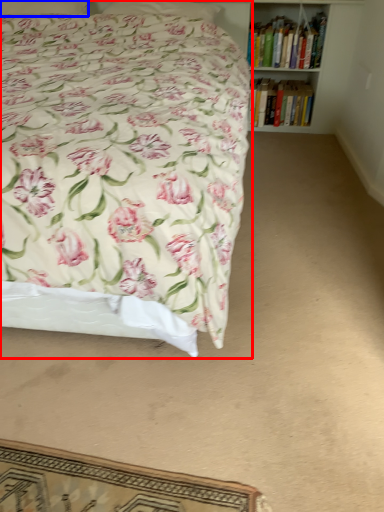
Question: Which of the following is the closest to the observer, bed (highlighted by a red box) or pillow (highlighted by a blue box)?

Choices:
 (A) bed
 (B) pillow

Answer: (A)